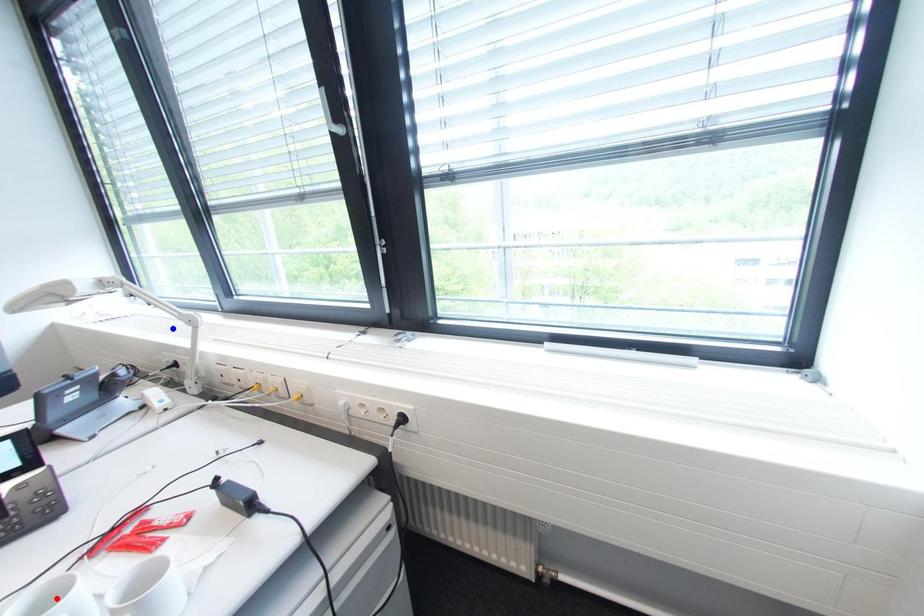
Question: In the image, two points are highlighted. Which point is nearer to the camera? Reply with the corresponding letter.

Choices:
 (A) blue point
 (B) red point

Answer: (B)